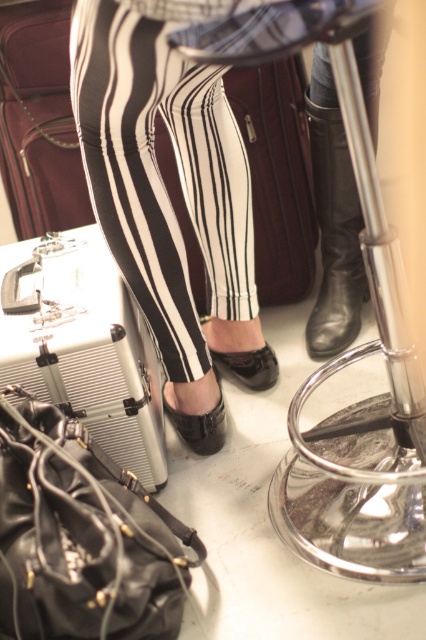
You are packing for a trip and need to place your silver metallic case at lower left and black leather shoe at lower center into a storage compartment. The compartment has a width of 1 meter. Can both items fit side by side horizontally?

The silver metallic case at lower left is to the left of the black leather shoe at lower center, but their combined width isn not specified. Without knowing their individual dimensions, it is impossible to determine if they can fit side by side in the 1 meter wide compartment.

You are trying to place a new plant pot that is 0.5 meters wide between the shiny metallic bar stool at center and the wall. Is there enough space?

The shiny metallic bar stool at center is located at point (360, 412), but without knowing the distance to the wall, it is impossible to determine if there is enough space for the plant pot.